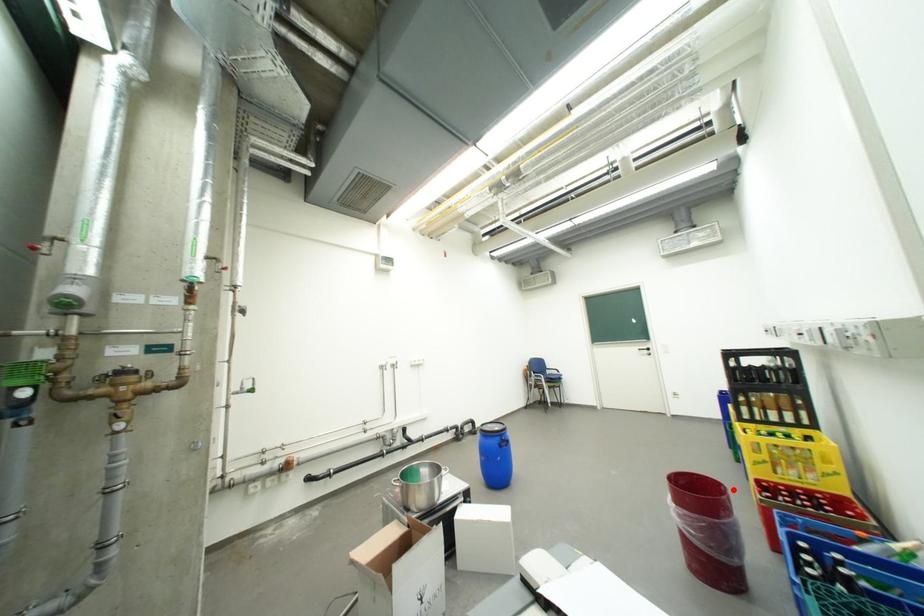
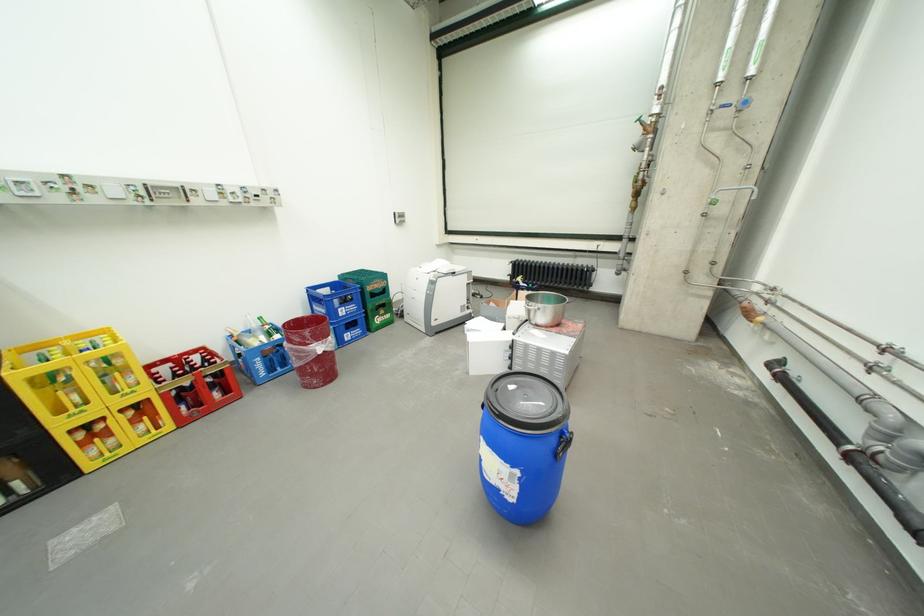
Question: I am providing you with two images of the same scene from different viewpoints. A red point is shown in image1. For the corresponding object point in image2, is it positioned nearer or farther from the camera?

Choices:
 (A) Nearer
 (B) Farther

Answer: (A)